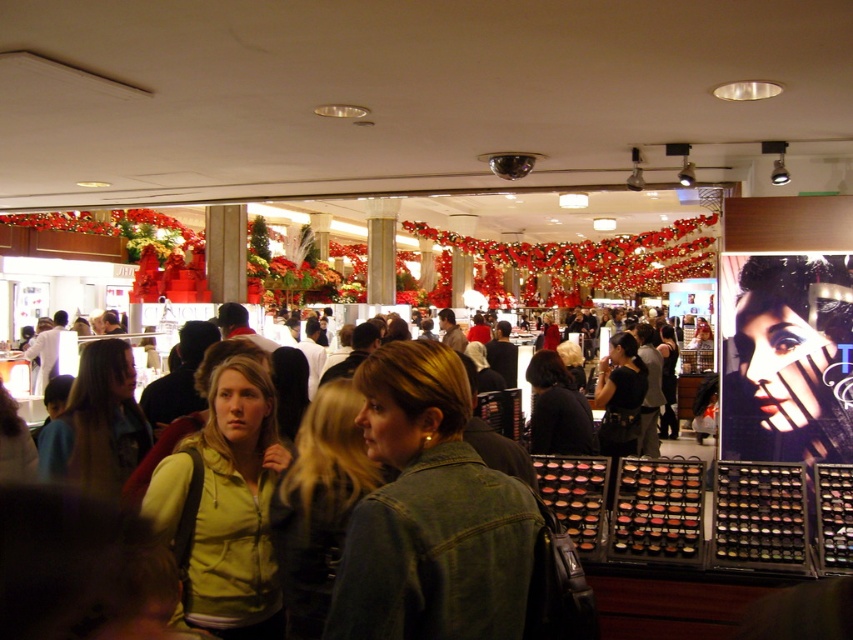
Who is taller, denim jacket at center or matte yellow hoodie at center?

Standing taller between the two is matte yellow hoodie at center.

Is point (514, 529) positioned behind point (171, 472)?

No, it is in front of (171, 472).

In order to click on denim jacket at center in this screenshot , I will do `click(430, 513)`.

Locate an element on the screen. denim jacket at center is located at coordinates (430, 513).